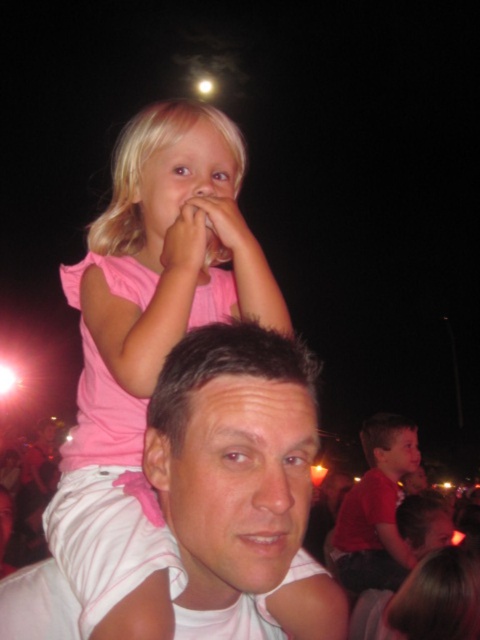
Question: Which point is farther from the camera taking this photo?

Choices:
 (A) (428, 538)
 (B) (193, 435)

Answer: (A)

Question: Is matte red shirt at center to the left of blonde hair at center from the viewer's perspective?

Choices:
 (A) no
 (B) yes

Answer: (A)

Question: Considering the real-world distances, which object is farthest from the smooth skin face at center?

Choices:
 (A) blonde hair at upper center
 (B) matte red shirt at center
 (C) blonde hair at center

Answer: (C)

Question: In this image, where is white cotton shirt at center located relative to smooth brown hair at center?

Choices:
 (A) above
 (B) below

Answer: (A)

Question: Among these objects, which one is farthest from the camera?

Choices:
 (A) pink fabric at upper left
 (B) matte red shirt at center
 (C) white cotton shirt at center

Answer: (B)

Question: Is white cotton shirt at center further to camera compared to blonde hair at upper center?

Choices:
 (A) yes
 (B) no

Answer: (B)